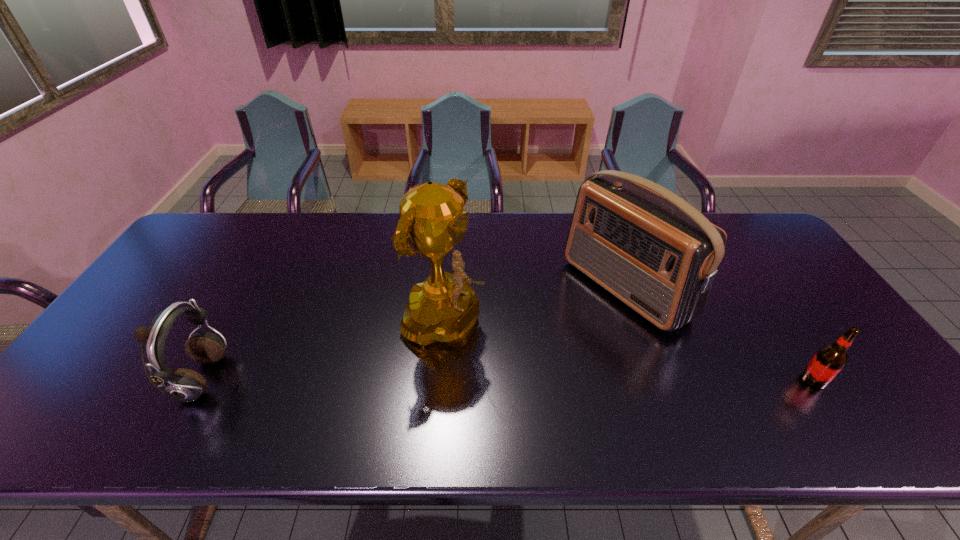
Find the location of a particular element. The height and width of the screenshot is (540, 960). the third tallest object is located at coordinates (184, 385).

Where is `the leftmost object`? the leftmost object is located at coordinates (184, 385).

Where is `the rightmost object`? The width and height of the screenshot is (960, 540). the rightmost object is located at coordinates (830, 359).

Locate an element on the screen. The image size is (960, 540). root beer is located at coordinates (830, 359).

In order to click on the second object from right to left in this screenshot , I will do `click(651, 249)`.

Find the location of a particular element. the third shortest object is located at coordinates (651, 249).

Where is `award`? The width and height of the screenshot is (960, 540). award is located at coordinates (444, 308).

Find the location of a particular element. the tallest object is located at coordinates (444, 308).

Locate an element on the screen. Image resolution: width=960 pixels, height=540 pixels. vacant space located on the ear pads of the second shortest object is located at coordinates (343, 379).

Locate an element on the screen. Image resolution: width=960 pixels, height=540 pixels. free space located 0.270m on the left of the shortest object is located at coordinates (689, 380).